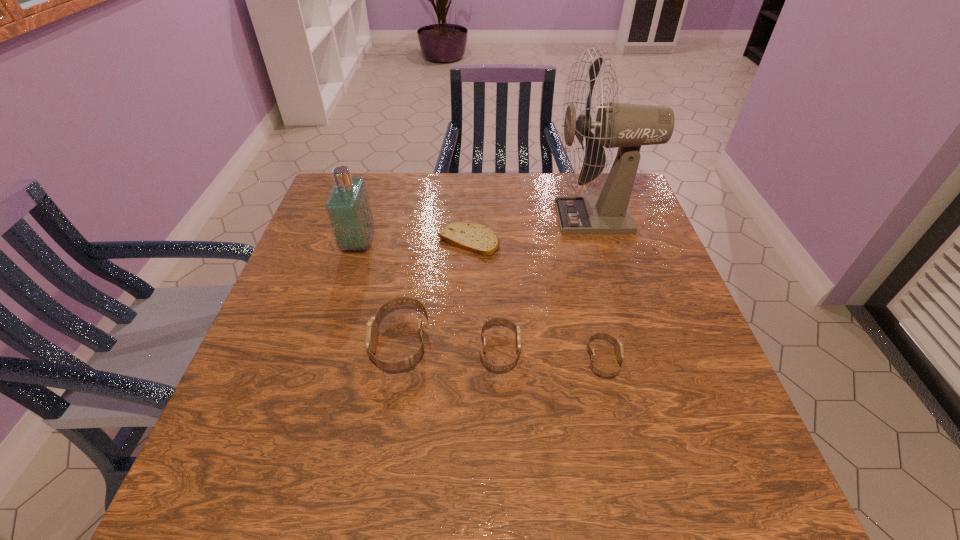
Find the location of a particular element. Image resolution: width=960 pixels, height=540 pixels. object present at the far edge is located at coordinates (628, 126).

In order to click on object that is positioned at the left edge in this screenshot , I will do `click(348, 207)`.

Where is `object at the right edge`? object at the right edge is located at coordinates (628, 126).

You are a GUI agent. You are given a task and a screenshot of the screen. Output one action in this format:
    pyautogui.click(x=<x>, y=<y>)
    Task: Click on the object present at the far right corner
    
    Given the screenshot: What is the action you would take?
    pyautogui.click(x=628, y=126)

At what (x,y) coordinates should I click in order to perform the action: click on vacant area at the far edge. Please return your answer as a coordinate pair (x, y). This screenshot has width=960, height=540. Looking at the image, I should click on pos(540,188).

The image size is (960, 540). Identify the location of vacant area at the left edge. (307, 234).

I want to click on vacant space at the right edge, so click(661, 326).

This screenshot has height=540, width=960. I want to click on vacant point at the near right corner, so click(x=672, y=429).

Find the location of a particular element. vacant area between the second shortest object and the pita bread is located at coordinates (536, 301).

Find the location of `vacant area between the shortest watch and the perfume`. vacant area between the shortest watch and the perfume is located at coordinates (481, 301).